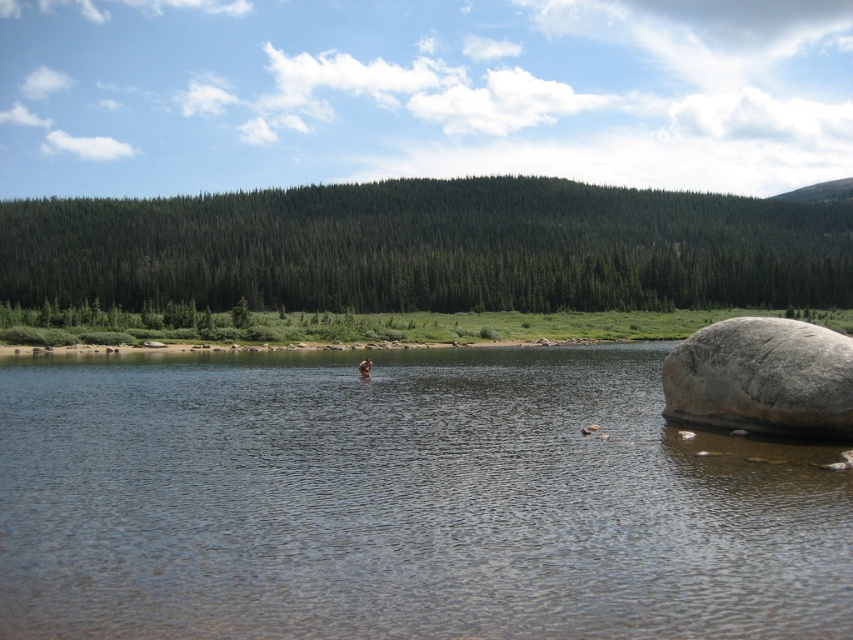
Question: Which point is closer to the camera taking this photo?

Choices:
 (A) (717, 378)
 (B) (369, 371)
 (C) (73, 518)

Answer: (C)

Question: Which object is farther from the camera taking this photo?

Choices:
 (A) clear water at center
 (B) smooth skin person at center
 (C) gray granite boulder at right

Answer: (B)

Question: Can you confirm if clear water at center is bigger than smooth skin person at center?

Choices:
 (A) no
 (B) yes

Answer: (B)

Question: Is clear water at center below smooth skin person at center?

Choices:
 (A) no
 (B) yes

Answer: (B)

Question: Is clear water at center smaller than smooth skin person at center?

Choices:
 (A) no
 (B) yes

Answer: (A)

Question: Which object appears farthest from the camera in this image?

Choices:
 (A) gray granite boulder at right
 (B) smooth skin person at center
 (C) clear water at center

Answer: (B)